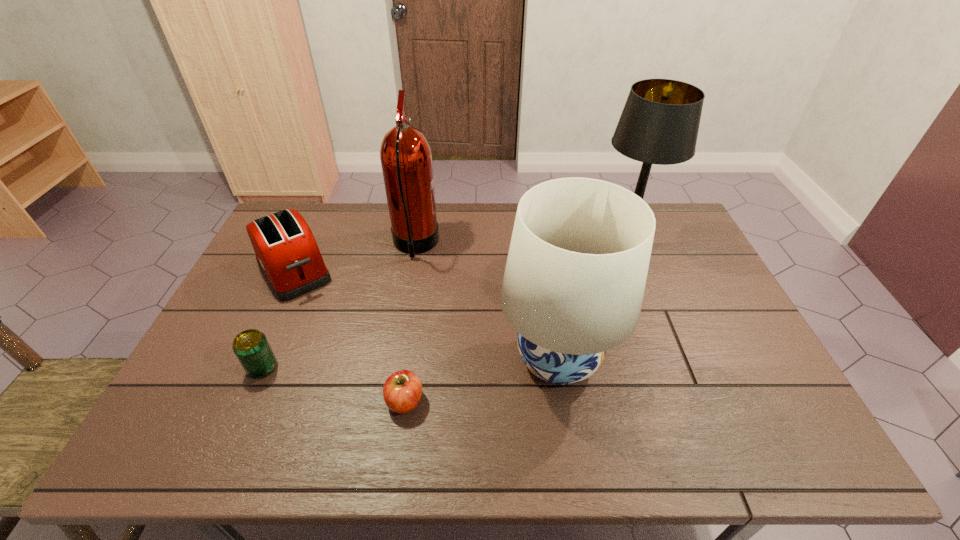
At what (x,y) coordinates should I click in order to perform the action: click on free space at the far edge of the desktop. Please return your answer as a coordinate pair (x, y). This screenshot has width=960, height=540. Looking at the image, I should click on (453, 230).

This screenshot has height=540, width=960. In the image, there is a desktop. What are the coordinates of `free space at the near edge` in the screenshot? It's located at (480, 426).

The image size is (960, 540). In the image, there is a desktop. Identify the location of vacant space at the left edge. (198, 422).

In the image, there is a desktop. Where is `vacant space at the right edge`? vacant space at the right edge is located at coordinates (784, 407).

I want to click on vacant space at the far left corner, so click(x=312, y=226).

In the image, there is a desktop. Where is `vacant space at the far right corner`? This screenshot has width=960, height=540. vacant space at the far right corner is located at coordinates (678, 226).

The image size is (960, 540). Find the location of `free space at the near right corner of the desktop`. free space at the near right corner of the desktop is located at coordinates (797, 452).

Find the location of `free space between the third shortest object and the fifth tallest object`. free space between the third shortest object and the fifth tallest object is located at coordinates (278, 320).

Where is `free spot between the fire extinguisher and the toaster`? Image resolution: width=960 pixels, height=540 pixels. free spot between the fire extinguisher and the toaster is located at coordinates (354, 258).

Where is `free space between the lampshade and the toaster`? This screenshot has width=960, height=540. free space between the lampshade and the toaster is located at coordinates (426, 315).